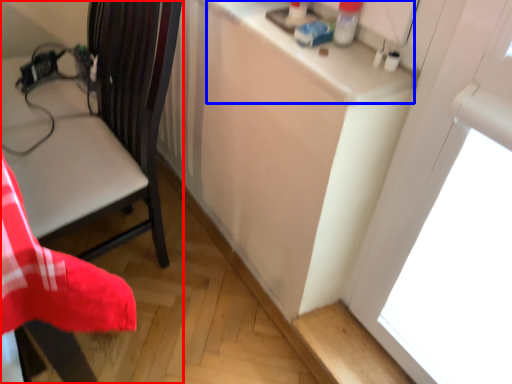
Question: Which of the following is the farthest to the observer, chair (highlighted by a red box) or counter top (highlighted by a blue box)?

Choices:
 (A) chair
 (B) counter top

Answer: (B)